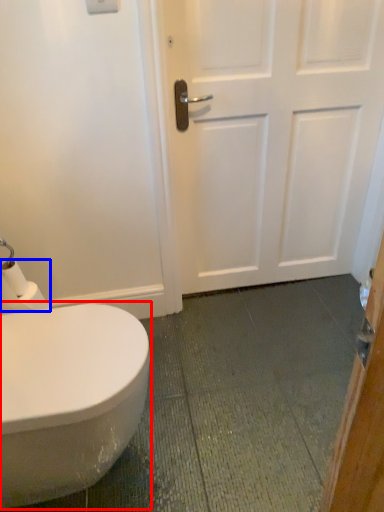
Question: Which of the following is the farthest to the observer, bidet (highlighted by a red box) or toilet paper (highlighted by a blue box)?

Choices:
 (A) bidet
 (B) toilet paper

Answer: (B)